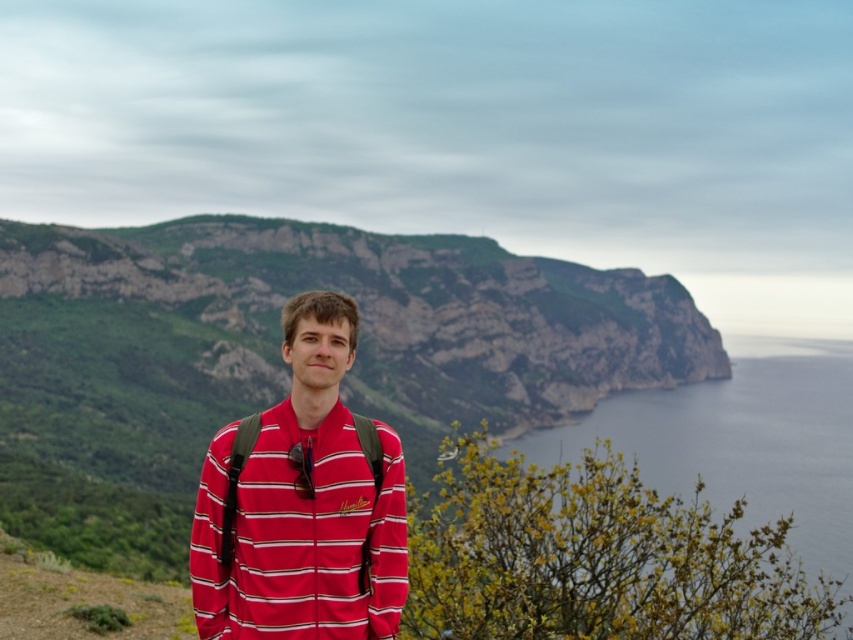
Question: Which object is closer to the camera taking this photo?

Choices:
 (A) red striped shirt at center
 (B) smooth blue water at lower right
 (C) green textured rock at center

Answer: (A)

Question: Can you confirm if red striped shirt at center is positioned above smooth blue water at lower right?

Choices:
 (A) yes
 (B) no

Answer: (A)

Question: Does red striped shirt at center have a greater width compared to smooth blue water at lower right?

Choices:
 (A) yes
 (B) no

Answer: (B)

Question: Can you confirm if red striped shirt at center is positioned to the right of smooth blue water at lower right?

Choices:
 (A) yes
 (B) no

Answer: (B)

Question: Which of these objects is positioned closest to the green textured rock at center?

Choices:
 (A) red striped shirt at center
 (B) smooth blue water at lower right

Answer: (B)

Question: Estimate the real-world distances between objects in this image. Which object is closer to the red striped shirt at center?

Choices:
 (A) green textured rock at center
 (B) smooth blue water at lower right

Answer: (A)